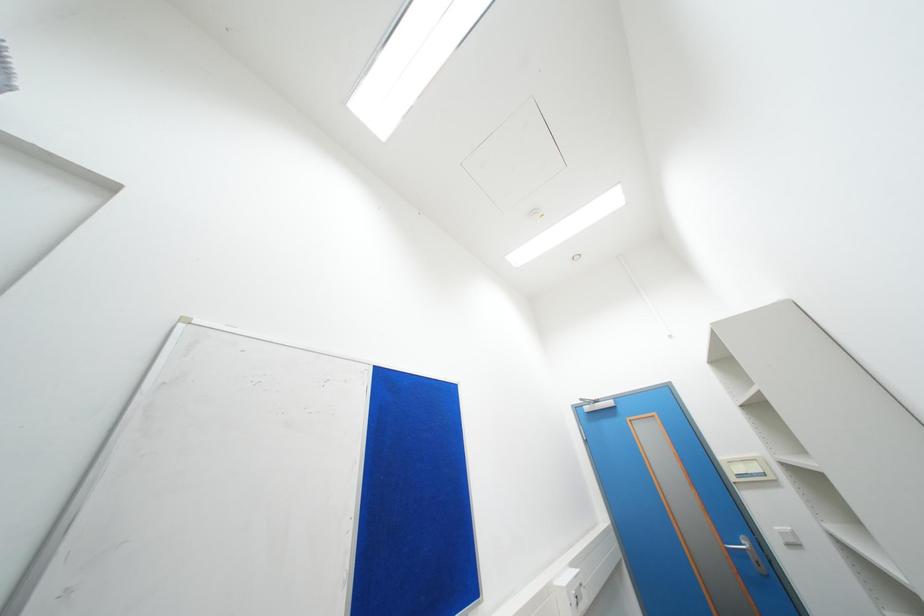
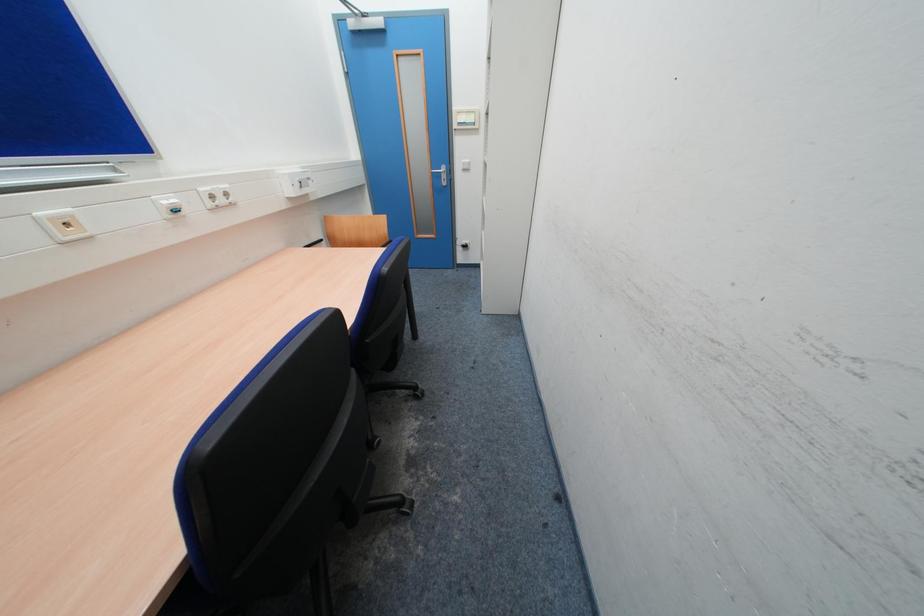
In the scene shown: The first image is from the beginning of the video and the second image is from the end. How did the camera likely rotate when shooting the video?

The rotation direction of the camera is right-down.